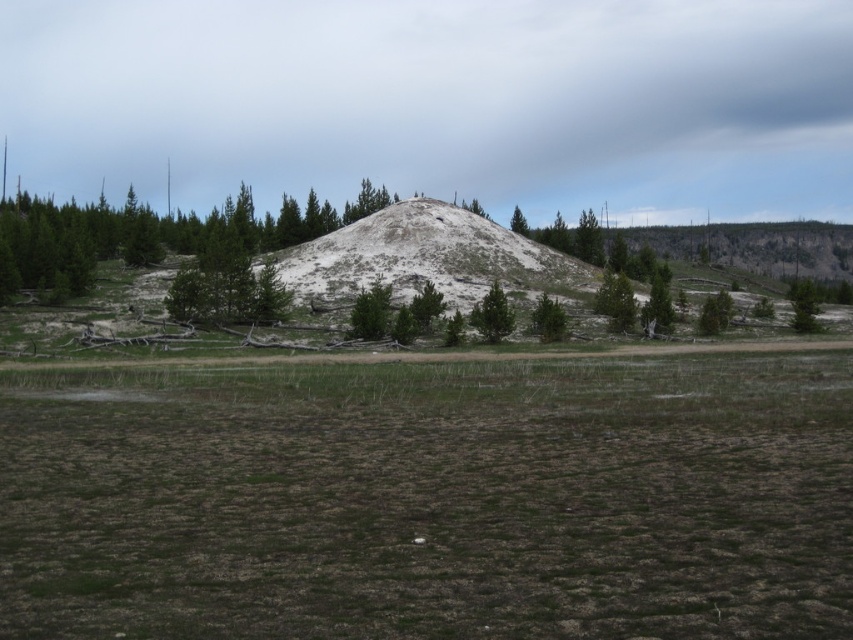
You are standing at the base of the large mound and want to walk towards the green matte tree at center and the green matte tree at upper center. Which tree will you reach first?

The green matte tree at center is closer to the viewer than the green matte tree at upper center, so you will reach the green matte tree at center first.

Based on the photo, you are a hiker planning to cross the area between the green grass at center and the green matte tree at upper center. The path you want to take is directly between them. Given that your backpack is 2 meters wide, will you be able to pass through without any issues?

The green grass at center is wider than the green matte tree at upper center, so the path between them is wide enough for a 2 meter wide backpack.